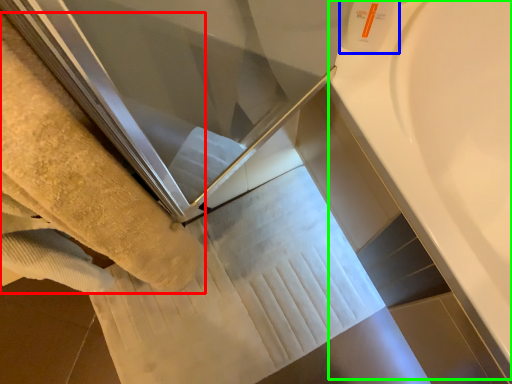
Question: Which object is the closest to the towel (highlighted by a red box)? Choose among these: toiletry (highlighted by a blue box) or bath (highlighted by a green box).

Choices:
 (A) toiletry
 (B) bath

Answer: (A)